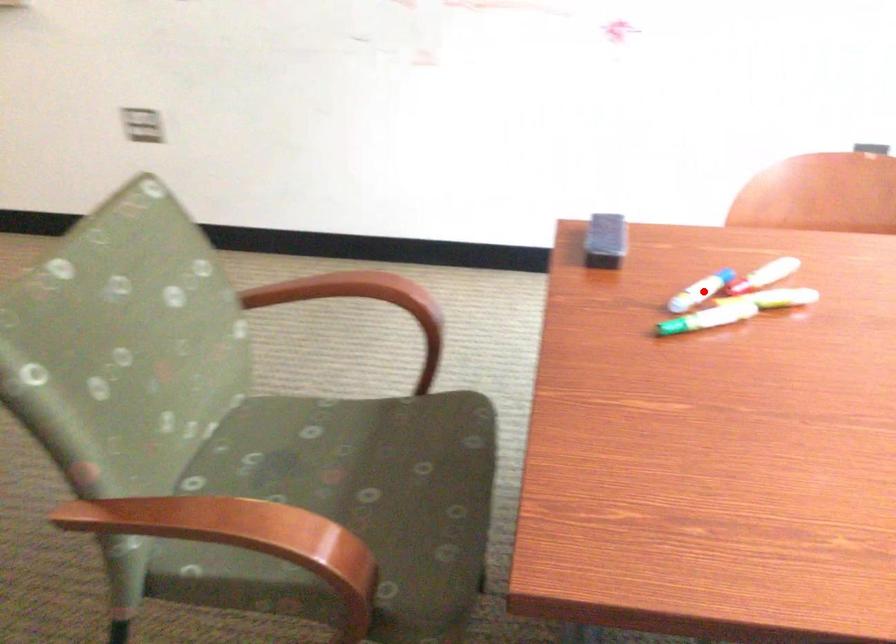
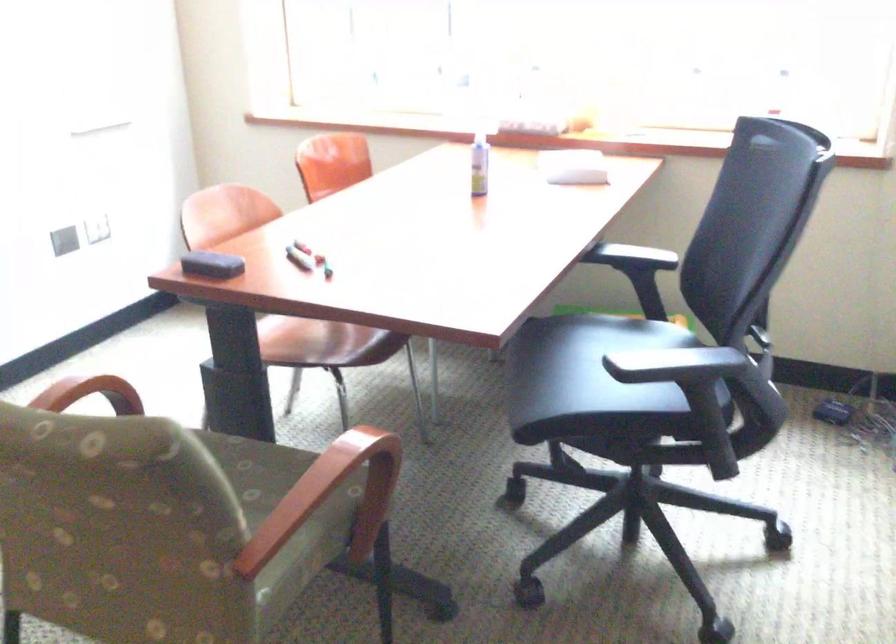
Question: I am providing you with two images of the same scene from different viewpoints. In image1, a red point is highlighted. Considering the same 3D point in image2, which of the following is correct?

Choices:
 (A) It is closer
 (B) It is farther

Answer: (B)